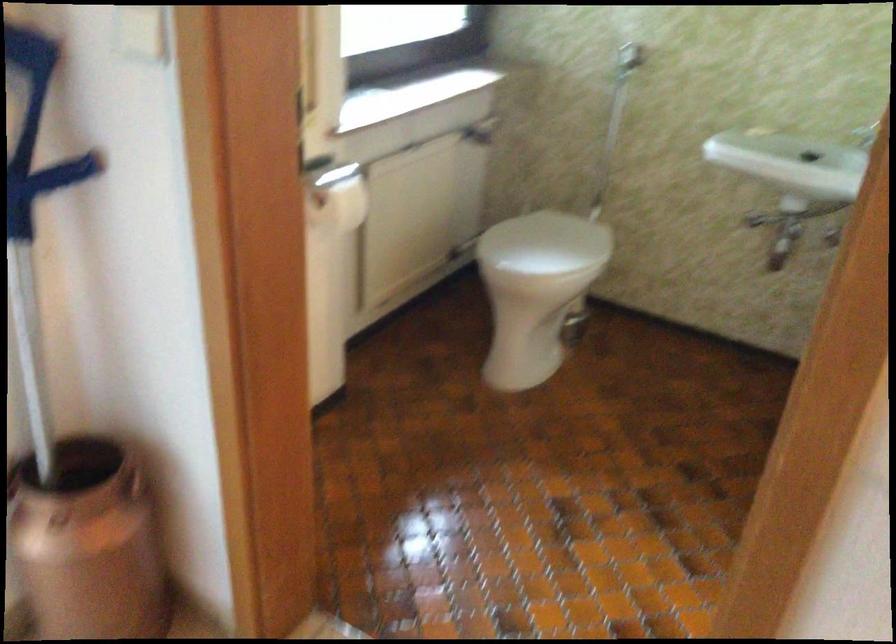
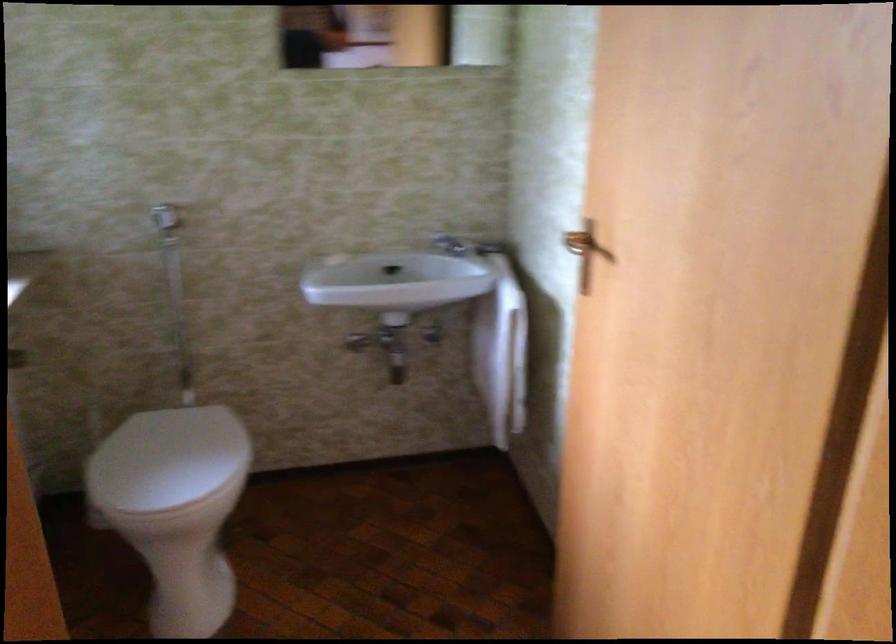
Question: The camera is either moving clockwise (left) or counter-clockwise (right) around the object. The first image is from the beginning of the video and the second image is from the end. Is the camera moving left or right when shooting the video?

Choices:
 (A) Left
 (B) Right

Answer: (A)